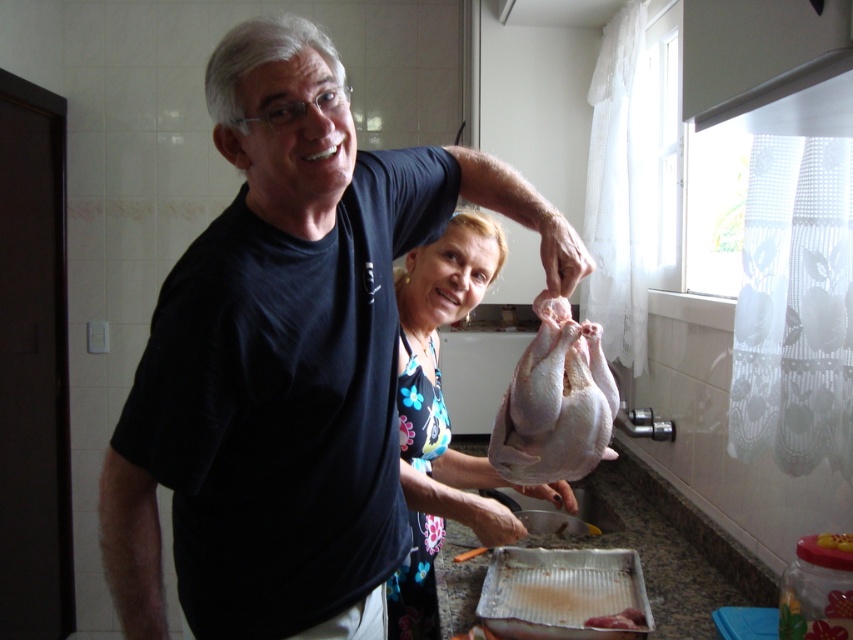
Does black matte shirt at center have a larger size compared to white raw chicken at center?

Yes, black matte shirt at center is bigger than white raw chicken at center.

Is point (321, 122) positioned after point (582, 401)?

No, (321, 122) is closer to viewer.

Find the location of a particular element. black matte shirt at center is located at coordinates [287, 358].

Where is `black matte shirt at center`? black matte shirt at center is located at coordinates (287, 358).

Does black matte shirt at center have a lesser height compared to white floral dress at center?

In fact, black matte shirt at center may be taller than white floral dress at center.

Can you confirm if black matte shirt at center is wider than white floral dress at center?

Indeed, black matte shirt at center has a greater width compared to white floral dress at center.

Where is `black matte shirt at center`? The image size is (853, 640). black matte shirt at center is located at coordinates (287, 358).

Between point (306, 294) and point (607, 625), which one is positioned in front?

Point (306, 294)

Consider the image. Between black matte shirt at center and pinkish raw meat at lower center, which one is positioned higher?

black matte shirt at center is higher up.

You are a GUI agent. You are given a task and a screenshot of the screen. Output one action in this format:
    pyautogui.click(x=<x>, y=<y>)
    Task: Click on the black matte shirt at center
    This screenshot has height=640, width=853.
    Given the screenshot: What is the action you would take?
    pyautogui.click(x=287, y=358)

Identify the location of black matte shirt at center. (287, 358).